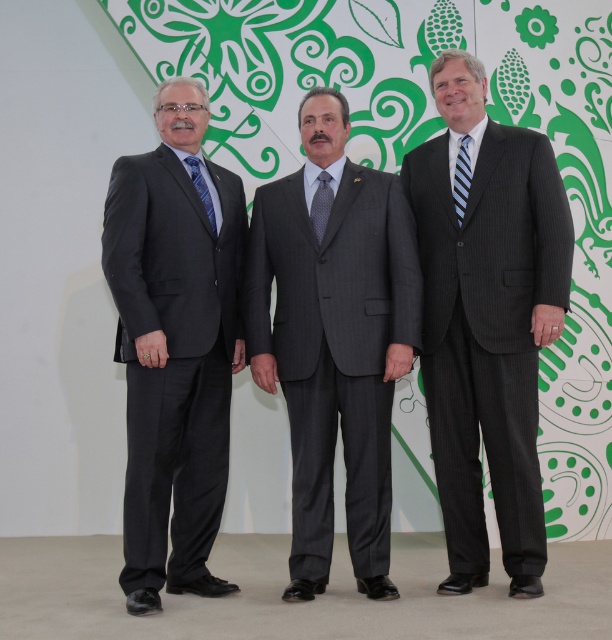
You are a fashion designer observing three men in an image. You need to determine which of the two suits, the pinstriped suit at center or the matte black suit at left, is more suitable for a formal event based on their sizes. Which one would you recommend?

The pinstriped suit at center is larger in size than the matte black suit at left, making it more appropriate for a formal event as larger suits often convey authority and confidence in such settings.

You are a fashion designer observing the three men in the image. You need to determine which item is taller between the gray pinstripe suit at center and the blue silk tie at center. Based on the scene description, which one is taller?

The gray pinstripe suit at center is taller than the blue silk tie at center according to the description.

Based on the scene description, where is the pinstriped suit at center located in the image?

The pinstriped suit at center is located at point (487, 321) in the image.